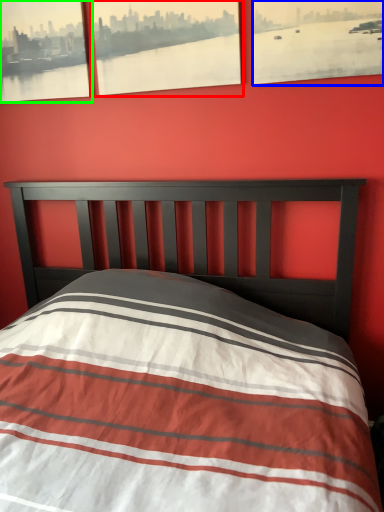
Question: Which object is the farthest from picture frame (highlighted by a red box)? Choose among these: picture frame (highlighted by a blue box) or picture frame (highlighted by a green box).

Choices:
 (A) picture frame
 (B) picture frame

Answer: (A)